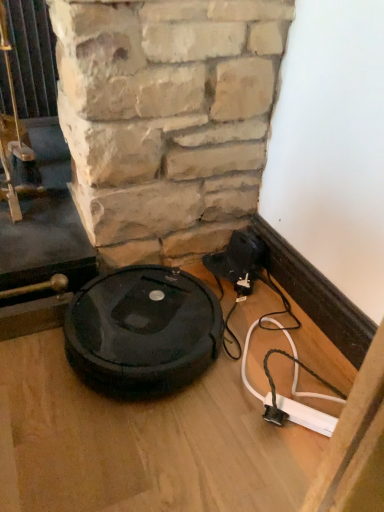
This screenshot has height=512, width=384. I want to click on vacant area in front of black plastic robot vacuum cleaner at lower left, so click(x=135, y=450).